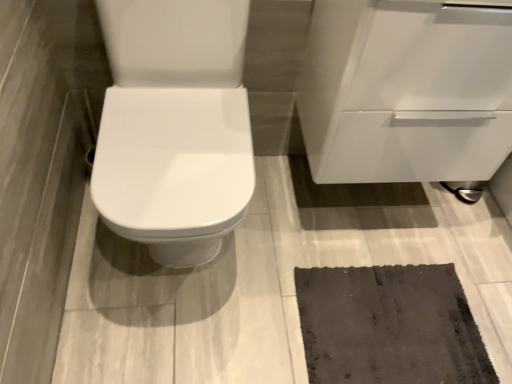
Identify the location of vacant region above dark gray textured mat at lower right (from a real-world perspective). (381, 326).